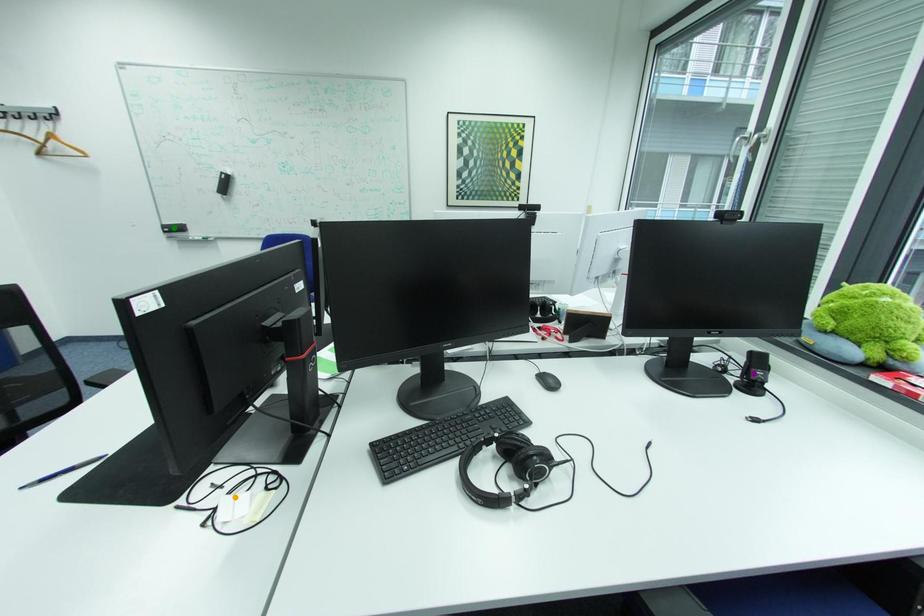
Order these from nearest to farthest:
1. orange point
2. green point
3. purple point

orange point, purple point, green point